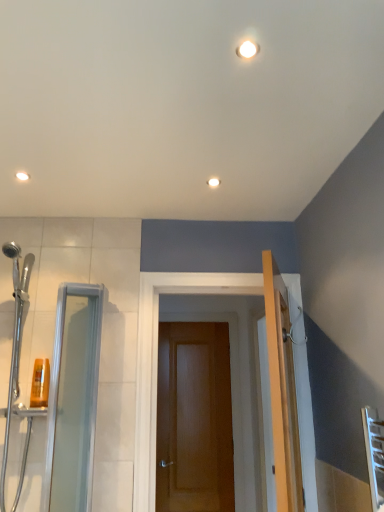
Question: Considering the relative sizes of transparent glass shower door at left and wooden door at center in the image provided, is transparent glass shower door at left shorter than wooden door at center?

Choices:
 (A) no
 (B) yes

Answer: (B)

Question: Considering the relative sizes of transparent glass shower door at left and wooden door at center in the image provided, is transparent glass shower door at left taller than wooden door at center?

Choices:
 (A) no
 (B) yes

Answer: (A)

Question: Considering the relative sizes of transparent glass shower door at left and wooden door at center in the image provided, is transparent glass shower door at left bigger than wooden door at center?

Choices:
 (A) no
 (B) yes

Answer: (B)

Question: From the image's perspective, is transparent glass shower door at left located beneath wooden door at center?

Choices:
 (A) yes
 (B) no

Answer: (B)

Question: Is transparent glass shower door at left positioned in front of wooden door at center?

Choices:
 (A) no
 (B) yes

Answer: (B)

Question: In the image, is white glossy light fixture at upper center positioned in front of or behind clear glass screen door at left?

Choices:
 (A) front
 (B) behind

Answer: (B)

Question: Considering the relative positions of white glossy light fixture at upper center and clear glass screen door at left in the image provided, is white glossy light fixture at upper center to the left or to the right of clear glass screen door at left?

Choices:
 (A) left
 (B) right

Answer: (B)

Question: From a real-world perspective, is white glossy light fixture at upper center physically located above or below clear glass screen door at left?

Choices:
 (A) below
 (B) above

Answer: (B)

Question: From their relative heights in the image, would you say white glossy light fixture at upper center is taller or shorter than clear glass screen door at left?

Choices:
 (A) tall
 (B) short

Answer: (B)

Question: In the image, is translucent plastic shampoo bottle at left on the left side or the right side of white glossy light fixture at upper center?

Choices:
 (A) left
 (B) right

Answer: (A)

Question: From their relative heights in the image, would you say translucent plastic shampoo bottle at left is taller or shorter than white glossy light fixture at upper center?

Choices:
 (A) short
 (B) tall

Answer: (B)

Question: In the image, is translucent plastic shampoo bottle at left positioned in front of or behind white glossy light fixture at upper center?

Choices:
 (A) behind
 (B) front

Answer: (A)

Question: From the image's perspective, is translucent plastic shampoo bottle at left above or below white glossy light fixture at upper center?

Choices:
 (A) below
 (B) above

Answer: (A)

Question: From a real-world perspective, is wooden door at center positioned above or below transparent glass shower door at left?

Choices:
 (A) above
 (B) below

Answer: (B)

Question: Would you say wooden door at center is to the left or to the right of transparent glass shower door at left in the picture?

Choices:
 (A) right
 (B) left

Answer: (A)